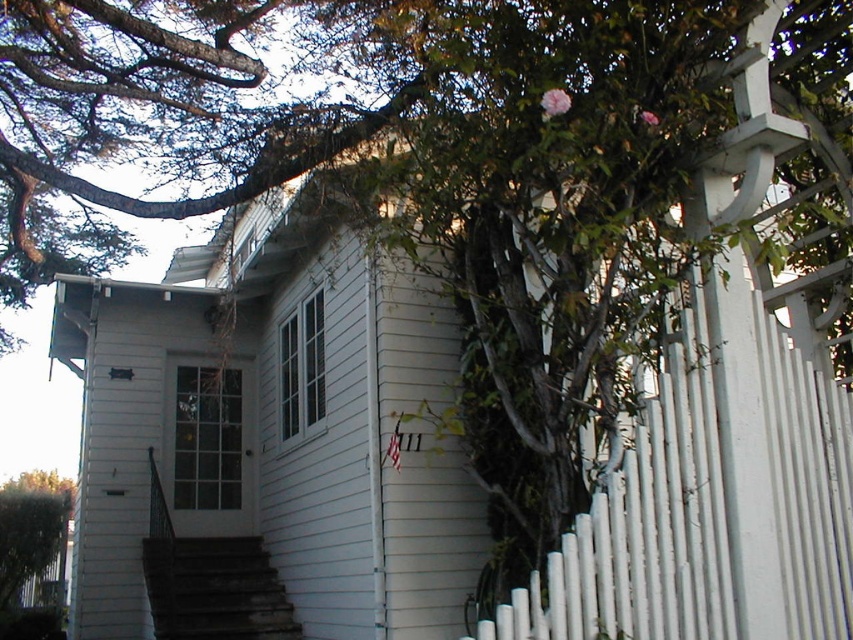
Can you confirm if dark gray concrete stairs at lower center is smaller than green leafy tree at lower left?

Correct, dark gray concrete stairs at lower center occupies less space than green leafy tree at lower left.

Is dark gray concrete stairs at lower center to the left of green leafy tree at lower left from the viewer's perspective?

No, dark gray concrete stairs at lower center is not to the left of green leafy tree at lower left.

Image resolution: width=853 pixels, height=640 pixels. I want to click on dark gray concrete stairs at lower center, so click(x=213, y=589).